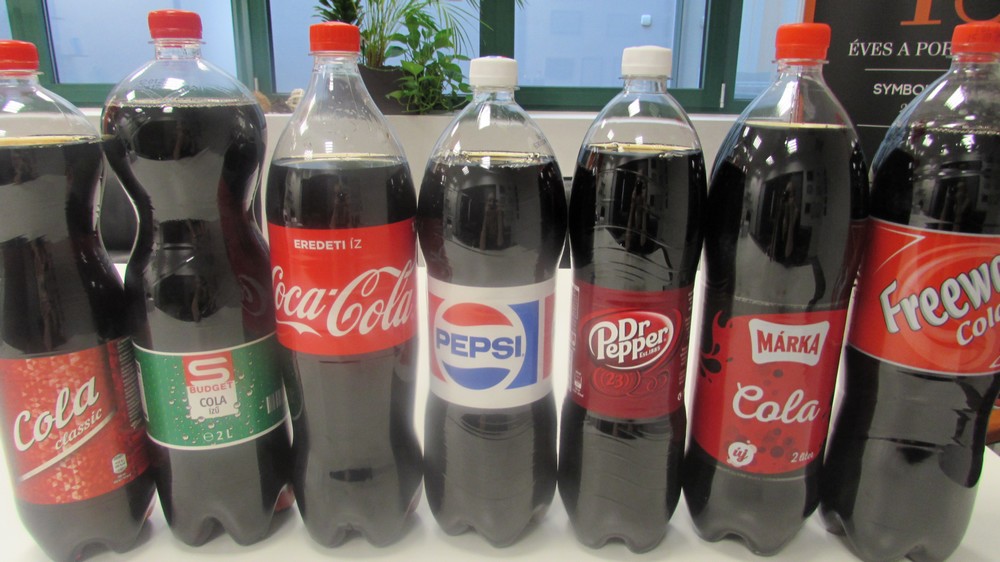
Where is `bottles of soda`? The width and height of the screenshot is (1000, 562). bottles of soda is located at coordinates (63, 409), (193, 388), (328, 334), (495, 326), (637, 353), (787, 352), (938, 330).